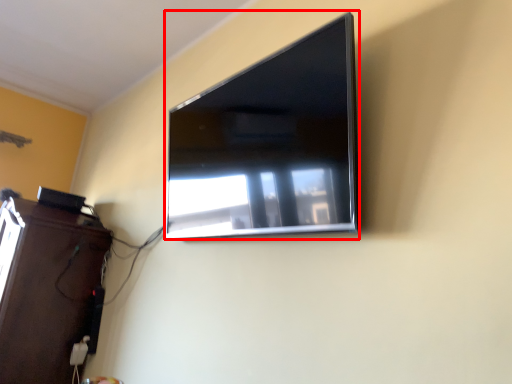
Question: From the image's perspective, what is the correct spatial relationship of television (annotated by the red box) in relation to furniture?

Choices:
 (A) above
 (B) below

Answer: (A)